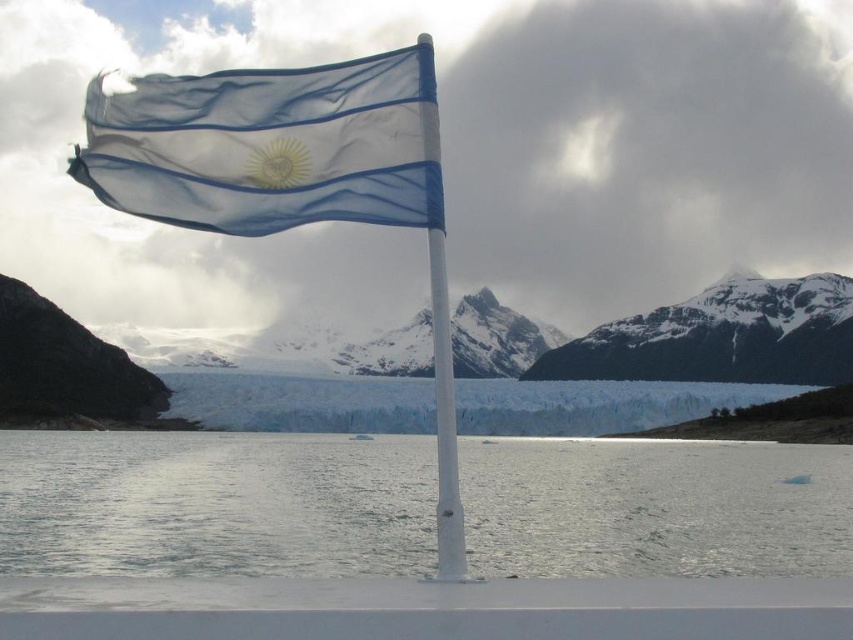
Based on the photo, you are standing on a boat and see the point marked at coordinates (289, 177) in the image. What object does this point correspond to?

The point marked at coordinates (289, 177) corresponds to the white plastic flag pole at center.